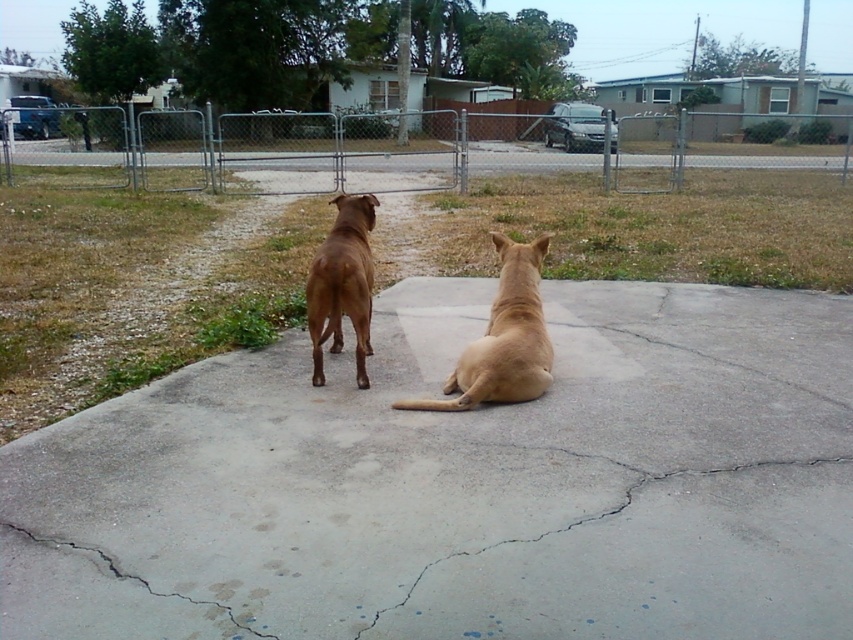
Question: Can you confirm if gray concrete crack at center is bigger than light brown fur at center?

Choices:
 (A) yes
 (B) no

Answer: (A)

Question: Estimate the real-world distances between objects in this image. Which object is farther from the light brown fur at center?

Choices:
 (A) gray concrete crack at center
 (B) metallic chain-link fence at upper center
 (C) gray concrete pavement at center

Answer: (B)

Question: Can you confirm if gray concrete pavement at center is thinner than light brown fur at center?

Choices:
 (A) no
 (B) yes

Answer: (A)

Question: Which of the following is the closest to the observer?

Choices:
 (A) gray concrete pavement at center
 (B) light brown fur at center
 (C) brown glossy dog at center

Answer: (A)

Question: Can you confirm if gray concrete pavement at center is bigger than gray concrete crack at center?

Choices:
 (A) no
 (B) yes

Answer: (B)

Question: Which of these objects is positioned farthest from the brown glossy dog at center?

Choices:
 (A) metallic chain-link fence at upper center
 (B) gray concrete crack at center
 (C) light brown fur at center

Answer: (A)